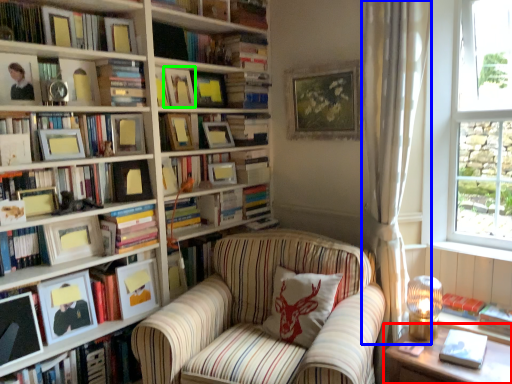
Question: Which object is the farthest from table (highlighted by a red box)? Choose among these: curtain (highlighted by a blue box) or picture frame (highlighted by a green box).

Choices:
 (A) curtain
 (B) picture frame

Answer: (B)